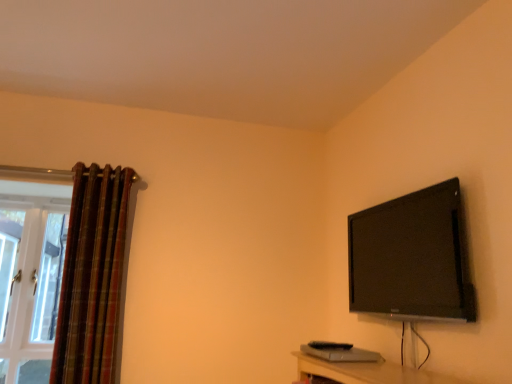
Question: Is white glass door at left oriented towards black glossy tv at upper right?

Choices:
 (A) yes
 (B) no

Answer: (B)

Question: Considering the relative sizes of white glass door at left and black glossy tv at upper right in the image provided, is white glass door at left smaller than black glossy tv at upper right?

Choices:
 (A) no
 (B) yes

Answer: (B)

Question: Does white glass door at left have a greater height compared to black glossy tv at upper right?

Choices:
 (A) no
 (B) yes

Answer: (B)

Question: Is white glass door at left next to black glossy tv at upper right?

Choices:
 (A) yes
 (B) no

Answer: (B)

Question: Is white glass door at left not near black glossy tv at upper right?

Choices:
 (A) yes
 (B) no

Answer: (A)

Question: Is white glass door at left outside of black glossy tv at upper right?

Choices:
 (A) no
 (B) yes

Answer: (B)

Question: From a real-world perspective, is plaid fabric curtain at left physically below white glass door at left?

Choices:
 (A) yes
 (B) no

Answer: (B)

Question: Is white glass door at left surrounded by plaid fabric curtain at left?

Choices:
 (A) yes
 (B) no

Answer: (B)

Question: Is plaid fabric curtain at left turned away from white glass door at left?

Choices:
 (A) no
 (B) yes

Answer: (A)

Question: Is plaid fabric curtain at left completely or partially outside of white glass door at left?

Choices:
 (A) yes
 (B) no

Answer: (A)

Question: Can you confirm if plaid fabric curtain at left is shorter than white glass door at left?

Choices:
 (A) yes
 (B) no

Answer: (B)

Question: Does plaid fabric curtain at left appear on the right side of white glass door at left?

Choices:
 (A) yes
 (B) no

Answer: (A)

Question: Is black glossy tv at upper right wider than white glass door at left?

Choices:
 (A) no
 (B) yes

Answer: (B)